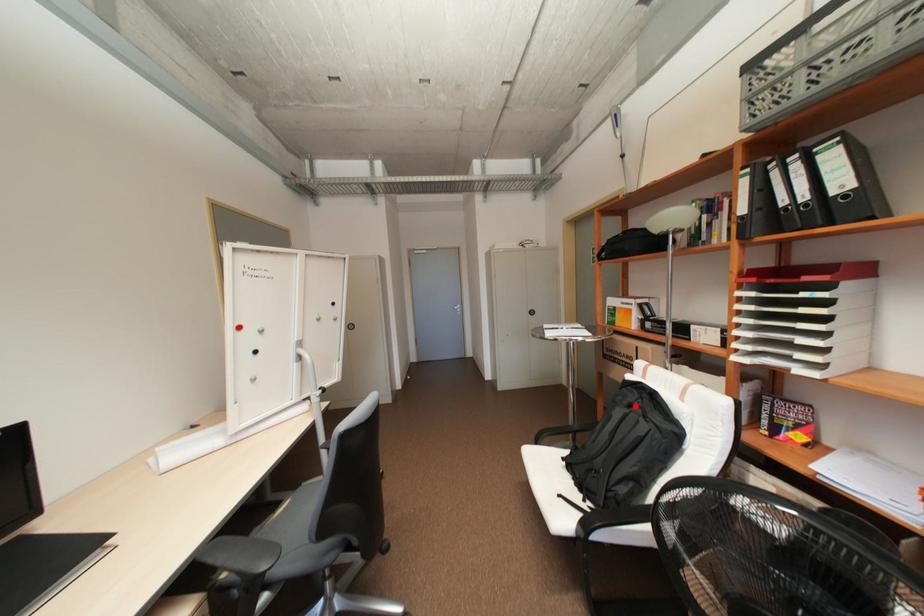
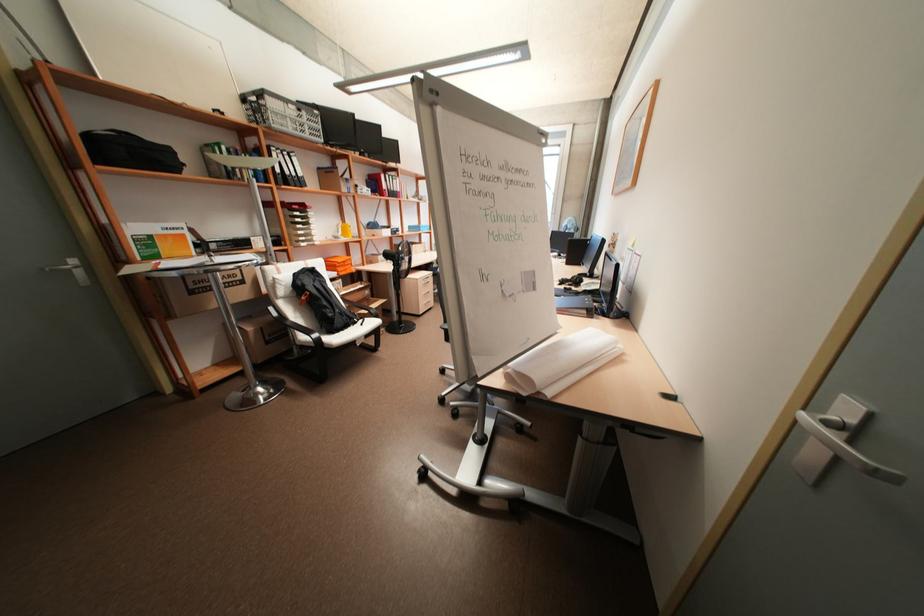
Find the pixel in the second image that matches the highlighted location in the first image.

(320, 281)